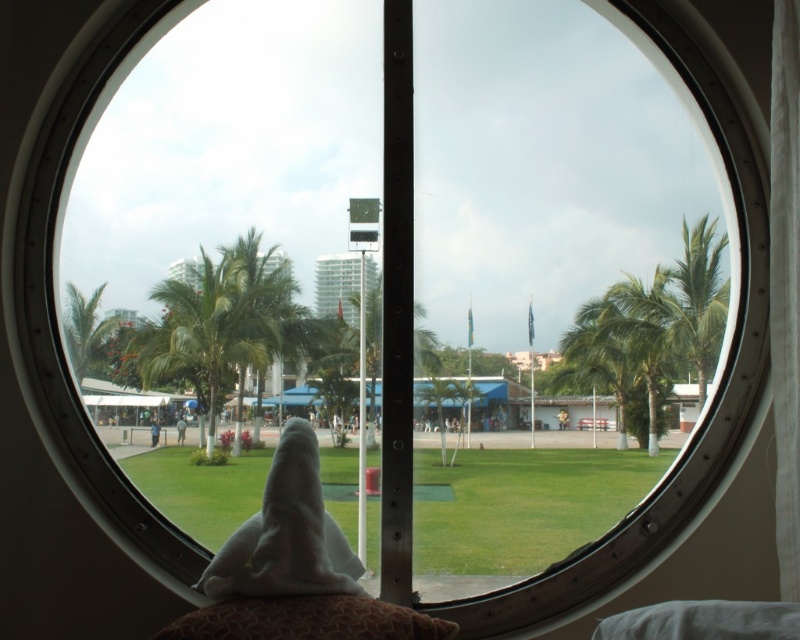
You are standing in a room and want to reach the white fluffy towel at center through the circular window. The window is 1.5 meters wide. Can you stretch your arm through the window to grab the towel?

The distance between you and the white fluffy towel at center is 2.08 meters, which is greater than the window width of 1.5 meters. Therefore, you cannot stretch your arm through the window to grab the towel.